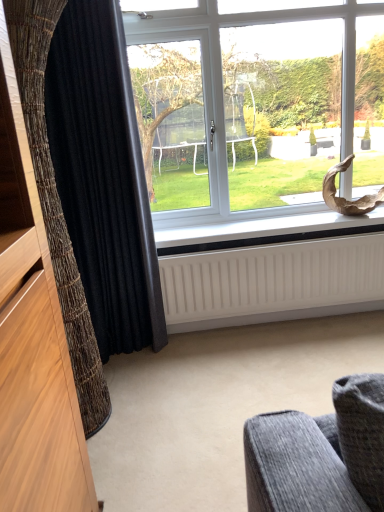
Locate an element on the screen. This screenshot has width=384, height=512. white ribbed radiator at lower center is located at coordinates (273, 282).

This screenshot has height=512, width=384. What do you see at coordinates (255, 112) in the screenshot? I see `transparent glass window at center` at bounding box center [255, 112].

Identify the location of transparent glass window at center. (255, 112).

Locate an element on the screen. The height and width of the screenshot is (512, 384). black textured curtain at left, which appears as the second curtain when viewed from the front is located at coordinates pos(102,178).

Locate an element on the screen. Image resolution: width=384 pixels, height=512 pixels. white matte radiator at lower center is located at coordinates pos(265,231).

Is black textured curtain at left, which is counted as the first curtain, starting from the front, taller or shorter than black textured curtain at left, the first curtain positioned from the back?

Clearly, black textured curtain at left, which is counted as the first curtain, starting from the front, is shorter compared to black textured curtain at left, the first curtain positioned from the back.

How many degrees apart are the facing directions of black textured curtain at left, positioned as the 2th curtain in back-to-front order, and black textured curtain at left, the first curtain positioned from the back?

The facing directions of black textured curtain at left, positioned as the 2th curtain in back-to-front order, and black textured curtain at left, the first curtain positioned from the back, are 89.2 degrees apart.

In the scene shown: Does black textured curtain at left, positioned as the 2th curtain in back-to-front order, have a smaller size compared to black textured curtain at left, the first curtain positioned from the back?

No, black textured curtain at left, positioned as the 2th curtain in back-to-front order, is not smaller than black textured curtain at left, the first curtain positioned from the back.

Can you confirm if black textured curtain at left, positioned as the 2th curtain in back-to-front order, is positioned to the left of black textured curtain at left, which appears as the second curtain when viewed from the front?

Correct, you'll find black textured curtain at left, positioned as the 2th curtain in back-to-front order, to the left of black textured curtain at left, which appears as the second curtain when viewed from the front.

Who is shorter, white ribbed radiator at lower center or transparent glass window at center?

With less height is white ribbed radiator at lower center.

Looking at this image, what's the angular difference between white ribbed radiator at lower center and transparent glass window at center's facing directions?

The facing directions of white ribbed radiator at lower center and transparent glass window at center are 0.0587 degrees apart.

From a real-world perspective, which object stands above the other?

transparent glass window at center.

Is transparent glass window at center a part of white ribbed radiator at lower center?

No, white ribbed radiator at lower center does not contain transparent glass window at center.

Which of these two, transparent glass window at center or black textured curtain at left, which appears as the second curtain when viewed from the front, is wider?

transparent glass window at center is wider.

Is transparent glass window at center taller than black textured curtain at left, which appears as the second curtain when viewed from the front?

No.

Does transparent glass window at center contain black textured curtain at left, the first curtain positioned from the back?

No, black textured curtain at left, the first curtain positioned from the back, is not a part of transparent glass window at center.

Is transparent glass window at center to the right of black textured curtain at left, the first curtain positioned from the back, from the viewer's perspective?

Yes, transparent glass window at center is to the right of black textured curtain at left, the first curtain positioned from the back.

How different are the orientations of black textured curtain at left, the first curtain positioned from the back, and white matte radiator at lower center in degrees?

0.00025 degrees separate the facing orientations of black textured curtain at left, the first curtain positioned from the back, and white matte radiator at lower center.

Considering the sizes of black textured curtain at left, which appears as the second curtain when viewed from the front, and white matte radiator at lower center in the image, is black textured curtain at left, which appears as the second curtain when viewed from the front, wider or thinner than white matte radiator at lower center?

black textured curtain at left, which appears as the second curtain when viewed from the front, is thinner than white matte radiator at lower center.

Can you confirm if black textured curtain at left, the first curtain positioned from the back, is smaller than white matte radiator at lower center?

No, black textured curtain at left, the first curtain positioned from the back, is not smaller than white matte radiator at lower center.

Visually, is black textured curtain at left, positioned as the 2th curtain in back-to-front order, positioned to the left or to the right of white matte radiator at lower center?

In the image, black textured curtain at left, positioned as the 2th curtain in back-to-front order, appears on the left side of white matte radiator at lower center.

This screenshot has width=384, height=512. In the image, there is a black textured curtain at left, positioned as the 2th curtain in back-to-front order. What are the coordinates of `window sill above it (from the image's perspective)` in the screenshot? It's located at (265, 231).

Looking at this image, is black textured curtain at left, positioned as the 2th curtain in back-to-front order, looking in the opposite direction of white matte radiator at lower center?

That's not correct — black textured curtain at left, positioned as the 2th curtain in back-to-front order, is not looking away from white matte radiator at lower center.

From the picture: Can you tell me how much black textured curtain at left, positioned as the 2th curtain in back-to-front order, and white matte radiator at lower center differ in facing direction?

The angular difference between black textured curtain at left, positioned as the 2th curtain in back-to-front order, and white matte radiator at lower center is 89.2 degrees.

From a real-world perspective, between transparent glass window at center and white ribbed radiator at lower center, who is vertically higher?

In real-world perspective, transparent glass window at center is above.

Based on the photo, which object is positioned more to the right, transparent glass window at center or white ribbed radiator at lower center?

transparent glass window at center is more to the right.

Who is more distant, transparent glass window at center or white ribbed radiator at lower center?

white ribbed radiator at lower center.

Based on their sizes in the image, would you say transparent glass window at center is bigger or smaller than white ribbed radiator at lower center?

transparent glass window at center is bigger than white ribbed radiator at lower center.

Are black textured curtain at left, positioned as the 2th curtain in back-to-front order, and white ribbed radiator at lower center beside each other?

They are not placed beside each other.

The image size is (384, 512). I want to click on radiator that appears on the right of black textured curtain at left, which is counted as the first curtain, starting from the front, so pyautogui.click(x=273, y=282).

Which object is wider, black textured curtain at left, positioned as the 2th curtain in back-to-front order, or white ribbed radiator at lower center?

Wider between the two is black textured curtain at left, positioned as the 2th curtain in back-to-front order.

From the picture: Is black textured curtain at left, positioned as the 2th curtain in back-to-front order, positioned with its back to white ribbed radiator at lower center?

No, black textured curtain at left, positioned as the 2th curtain in back-to-front order, is not facing away from white ribbed radiator at lower center.

In the image, there is a black textured curtain at left, positioned as the 2th curtain in back-to-front order. Find the location of `curtain above it (from the image's perspective)`. curtain above it (from the image's perspective) is located at coordinates (102, 178).

Locate an element on the screen. Image resolution: width=384 pixels, height=512 pixels. radiator beneath the transparent glass window at center (from a real-world perspective) is located at coordinates (273, 282).

When comparing their distances from white ribbed radiator at lower center, does white matte radiator at lower center or transparent glass window at center seem closer?

Among the two, white matte radiator at lower center is located nearer to white ribbed radiator at lower center.

Based on their spatial positions, is black textured curtain at left, the first curtain positioned from the back, or white matte radiator at lower center further from white ribbed radiator at lower center?

black textured curtain at left, the first curtain positioned from the back.

Which object lies further to the anchor point black textured curtain at left, which is counted as the first curtain, starting from the front, white ribbed radiator at lower center or white matte radiator at lower center?

white matte radiator at lower center lies further to black textured curtain at left, which is counted as the first curtain, starting from the front, than the other object.

Looking at the image, which one is located further to black textured curtain at left, which appears as the second curtain when viewed from the front, white ribbed radiator at lower center or transparent glass window at center?

transparent glass window at center lies further to black textured curtain at left, which appears as the second curtain when viewed from the front, than the other object.

From the image, which object appears to be farther from black textured curtain at left, which appears as the second curtain when viewed from the front, transparent glass window at center or black textured curtain at left, which is counted as the first curtain, starting from the front?

→ transparent glass window at center.

Estimate the real-world distances between objects in this image. Which object is further from black textured curtain at left, the first curtain positioned from the back, white matte radiator at lower center or white ribbed radiator at lower center?

Among the two, white ribbed radiator at lower center is located further to black textured curtain at left, the first curtain positioned from the back.

Based on the photo, from the image, which object appears to be farther from transparent glass window at center, white matte radiator at lower center or black textured curtain at left, the first curtain positioned from the back?

black textured curtain at left, the first curtain positioned from the back, lies further to transparent glass window at center than the other object.

When comparing their distances from black textured curtain at left, which is counted as the first curtain, starting from the front, does white matte radiator at lower center or transparent glass window at center seem closer?

white matte radiator at lower center lies closer to black textured curtain at left, which is counted as the first curtain, starting from the front, than the other object.

The height and width of the screenshot is (512, 384). What are the coordinates of `curtain located between black textured curtain at left, which is counted as the first curtain, starting from the front, and white ribbed radiator at lower center in the depth direction` in the screenshot? It's located at (102, 178).

Image resolution: width=384 pixels, height=512 pixels. Identify the location of radiator located between black textured curtain at left, positioned as the 2th curtain in back-to-front order, and white matte radiator at lower center in the depth direction. (273, 282).

You are a GUI agent. You are given a task and a screenshot of the screen. Output one action in this format:
    pyautogui.click(x=<x>, y=<y>)
    Task: Click on the curtain between black textured curtain at left, which is counted as the first curtain, starting from the front, and transparent glass window at center
    
    Given the screenshot: What is the action you would take?
    pyautogui.click(x=102, y=178)

Locate an element on the screen. The height and width of the screenshot is (512, 384). radiator between black textured curtain at left, which appears as the second curtain when viewed from the front, and white matte radiator at lower center is located at coordinates (273, 282).